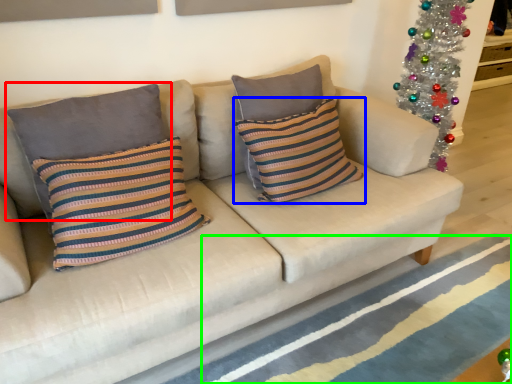
Question: Estimate the real-world distances between objects in this image. Which object is farther from pillow (highlighted by a red box), pillow (highlighted by a blue box) or stripe (highlighted by a green box)?

Choices:
 (A) pillow
 (B) stripe

Answer: (B)